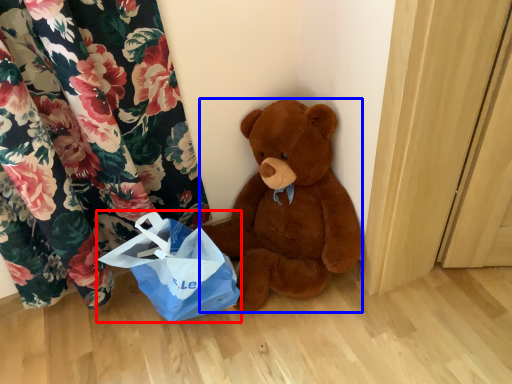
Question: Which point is further to the camera, grocery bag (highlighted by a red box) or teddy bear (highlighted by a blue box)?

Choices:
 (A) grocery bag
 (B) teddy bear

Answer: (A)